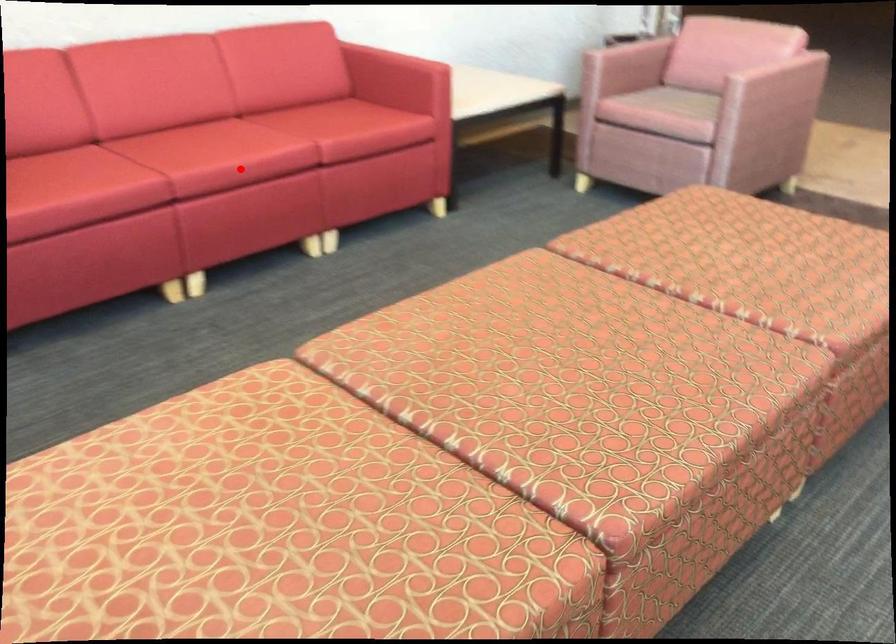
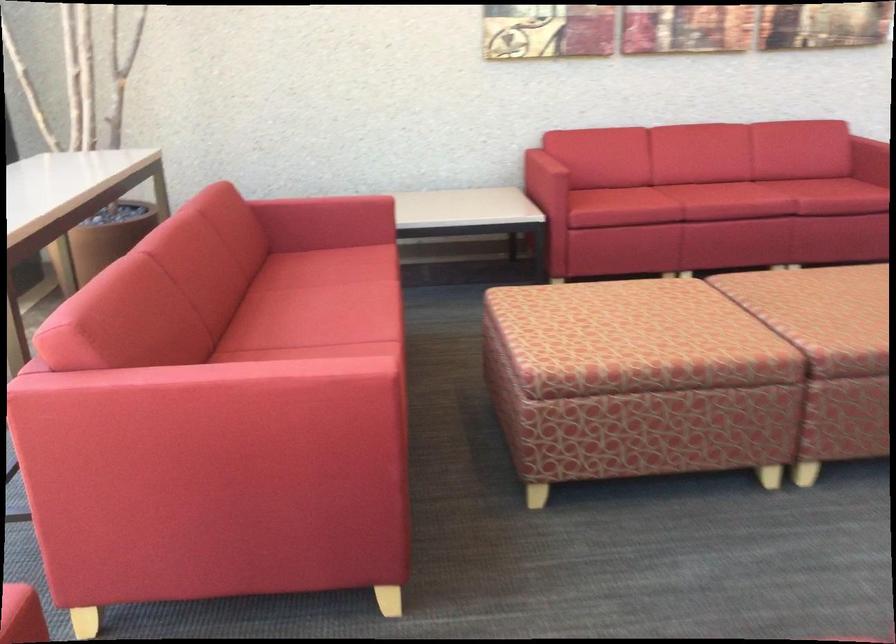
Find the pixel in the second image that matches the highlighted location in the first image.

(725, 201)